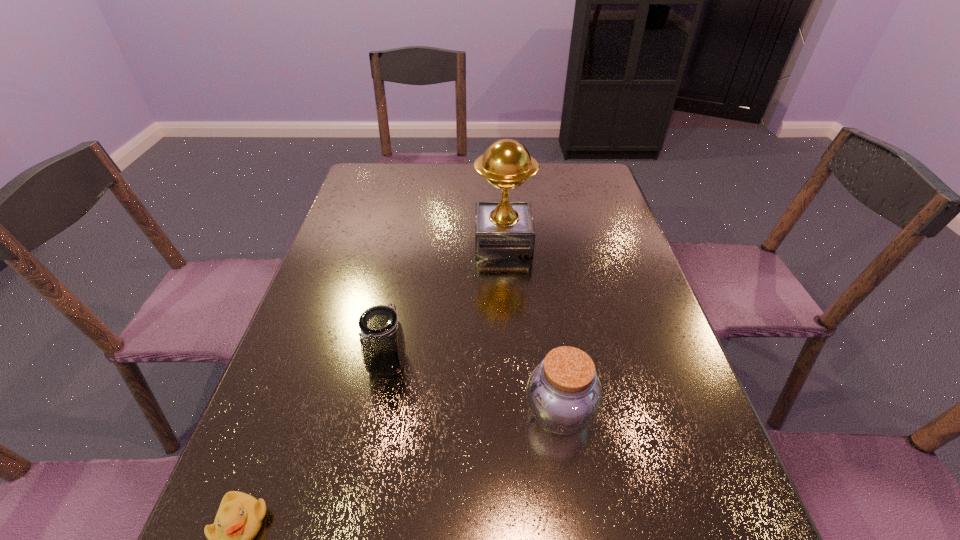
At what (x,y) coordinates should I click in order to perform the action: click on vacant space located 0.220m on the lid of the farther jar. Please return your answer as a coordinate pair (x, y). This screenshot has width=960, height=540. Looking at the image, I should click on (363, 491).

The height and width of the screenshot is (540, 960). I want to click on free space at the far edge of the desktop, so click(x=540, y=184).

In the image, there is a desktop. At what (x,y) coordinates should I click in order to perform the action: click on free space at the left edge. Please return your answer as a coordinate pair (x, y). The image size is (960, 540). Looking at the image, I should click on (351, 292).

Where is `vacant space at the right edge of the desktop`? The image size is (960, 540). vacant space at the right edge of the desktop is located at coordinates (650, 403).

This screenshot has height=540, width=960. Find the location of `vacant space at the far right corner of the desktop`. vacant space at the far right corner of the desktop is located at coordinates (559, 179).

Image resolution: width=960 pixels, height=540 pixels. I want to click on unoccupied position between the nearer jar and the award, so click(x=531, y=327).

Where is `free space between the award and the third nearest object`? This screenshot has width=960, height=540. free space between the award and the third nearest object is located at coordinates (445, 302).

Where is `free space between the farthest object and the second farthest object`? The image size is (960, 540). free space between the farthest object and the second farthest object is located at coordinates (445, 302).

Find the location of `vacant space in between the left jar and the farthest object`. vacant space in between the left jar and the farthest object is located at coordinates (445, 302).

Identify the location of empty space between the second farthest object and the award. (445, 302).